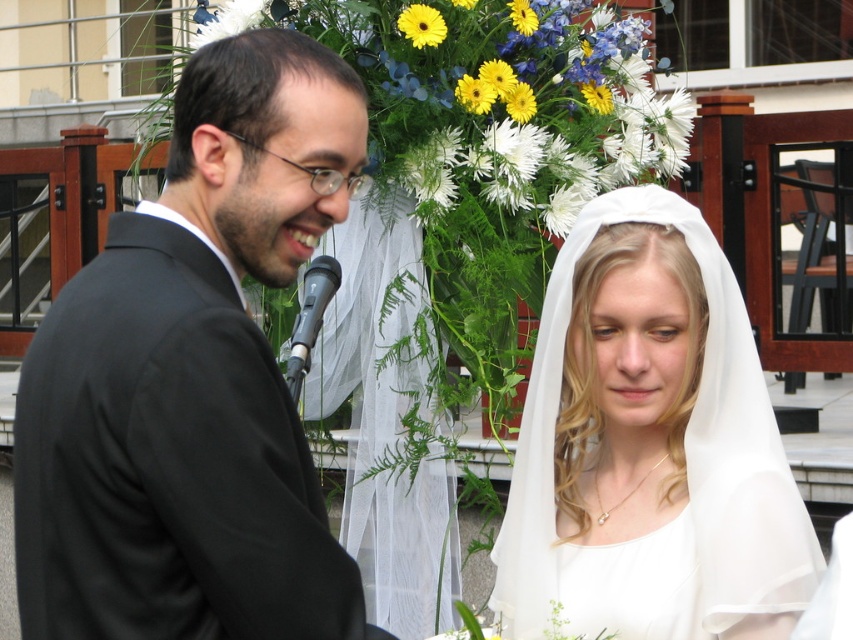
Question: Which of these objects is positioned closest to the white sheer veil at center?

Choices:
 (A) black matte suit at left
 (B) black metallic microphone at center

Answer: (B)

Question: Is black matte suit at left smaller than white sheer veil at center?

Choices:
 (A) yes
 (B) no

Answer: (B)

Question: Which of the following is the farthest from the observer?

Choices:
 (A) (556, 508)
 (B) (158, 620)

Answer: (A)

Question: Does white sheer veil at center appear on the left side of black metallic microphone at center?

Choices:
 (A) no
 (B) yes

Answer: (A)

Question: Which object appears closest to the camera in this image?

Choices:
 (A) white sheer veil at center
 (B) black metallic microphone at center
 (C) black matte suit at left

Answer: (C)

Question: Can you confirm if white sheer veil at center is positioned to the left of black metallic microphone at center?

Choices:
 (A) no
 (B) yes

Answer: (A)